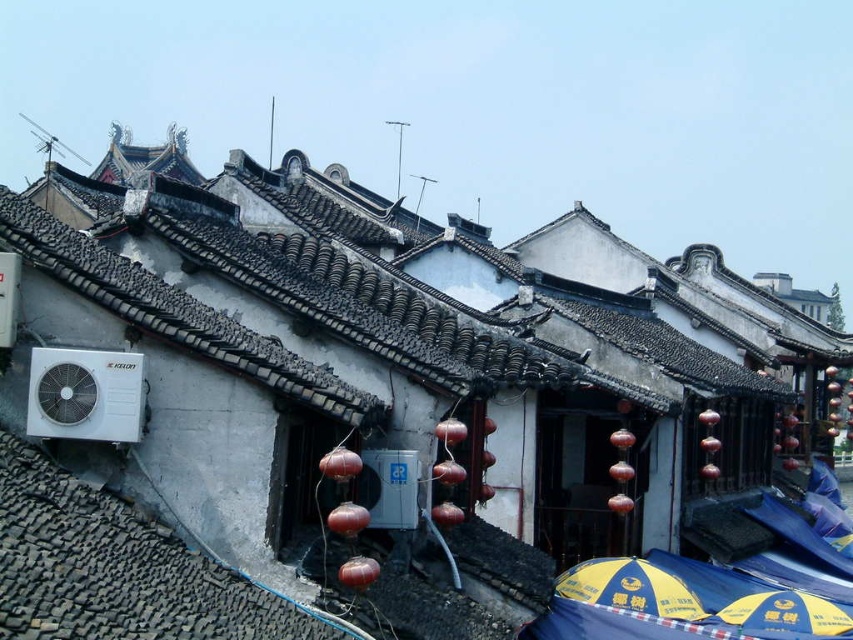
You are standing in front of the row of traditional Chinese buildings and want to take a photo of both the point at coordinates point (430,330) and point (675,609). Which point should you focus on first to ensure both are in the frame?

You should focus on point (675,609) first because it is closer to you than point (430,330), which is behind it. By focusing on the closer point, both points will be in the frame.